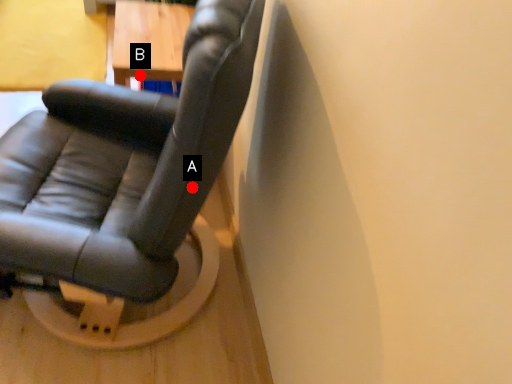
Question: Two points are circled on the image, labeled by A and B beside each circle. Which point is farther from the camera taking this photo?

Choices:
 (A) A is further
 (B) B is further

Answer: (B)